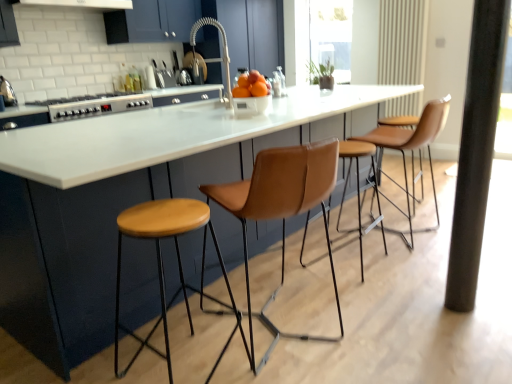
You are a GUI agent. You are given a task and a screenshot of the screen. Output one action in this format:
    pyautogui.click(x=<x>, y=<y>)
    Task: Click on the vacant space to the right of leather at center, the second chair when ordered from back to front
    
    Given the screenshot: What is the action you would take?
    pyautogui.click(x=391, y=324)